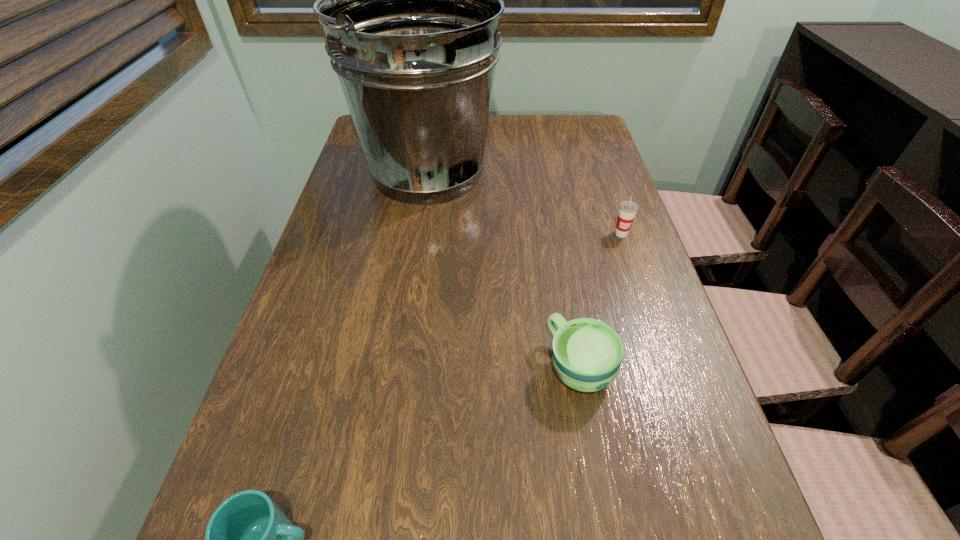
This screenshot has width=960, height=540. I want to click on vacant space that's between the bucket and the third farthest object, so click(x=503, y=269).

I want to click on the closest object to the third object from left to right, so click(628, 209).

Select which object is the third closest to the rightmost cup. Please provide its 2D coordinates. Your answer should be formatted as a tuple, i.e. [(x, y)], where the tuple contains the x and y coordinates of a point satisfying the conditions above.

[(249, 539)]

Find the location of a particular element. This screenshot has height=540, width=960. cup that is the closest one to the third object from left to right is located at coordinates (628, 209).

Where is `cup that is the second closest one to the rightmost cup`? The image size is (960, 540). cup that is the second closest one to the rightmost cup is located at coordinates (249, 539).